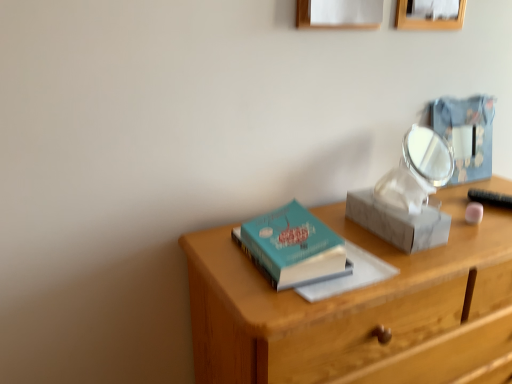
Question: Considering the relative sizes of white marble shoe box at center-right and wooden desk at center in the image provided, is white marble shoe box at center-right thinner than wooden desk at center?

Choices:
 (A) no
 (B) yes

Answer: (B)

Question: Would you say white marble shoe box at center-right is outside wooden desk at center?

Choices:
 (A) no
 (B) yes

Answer: (B)

Question: Is white marble shoe box at center-right far from wooden desk at center?

Choices:
 (A) yes
 (B) no

Answer: (B)

Question: From a real-world perspective, is white marble shoe box at center-right over wooden desk at center?

Choices:
 (A) yes
 (B) no

Answer: (A)

Question: Is white marble shoe box at center-right bigger than wooden desk at center?

Choices:
 (A) no
 (B) yes

Answer: (A)

Question: From the image's perspective, would you say white marble shoe box at center-right is shown under wooden desk at center?

Choices:
 (A) no
 (B) yes

Answer: (A)

Question: Is wooden desk at center smaller than white marble shoe box at center-right?

Choices:
 (A) no
 (B) yes

Answer: (A)

Question: From the image's perspective, is wooden desk at center beneath white marble shoe box at center-right?

Choices:
 (A) yes
 (B) no

Answer: (A)

Question: Is wooden desk at center in front of white marble shoe box at center-right?

Choices:
 (A) yes
 (B) no

Answer: (A)

Question: Is wooden desk at center at the right side of white marble shoe box at center-right?

Choices:
 (A) yes
 (B) no

Answer: (A)

Question: Considering the relative sizes of wooden desk at center and white marble shoe box at center-right in the image provided, is wooden desk at center thinner than white marble shoe box at center-right?

Choices:
 (A) yes
 (B) no

Answer: (B)

Question: Is wooden desk at center facing towards white marble shoe box at center-right?

Choices:
 (A) yes
 (B) no

Answer: (B)

Question: Can you confirm if metallic blue box at upper right is smaller than white paper at upper center, which is the second picture frame in right-to-left order?

Choices:
 (A) yes
 (B) no

Answer: (A)